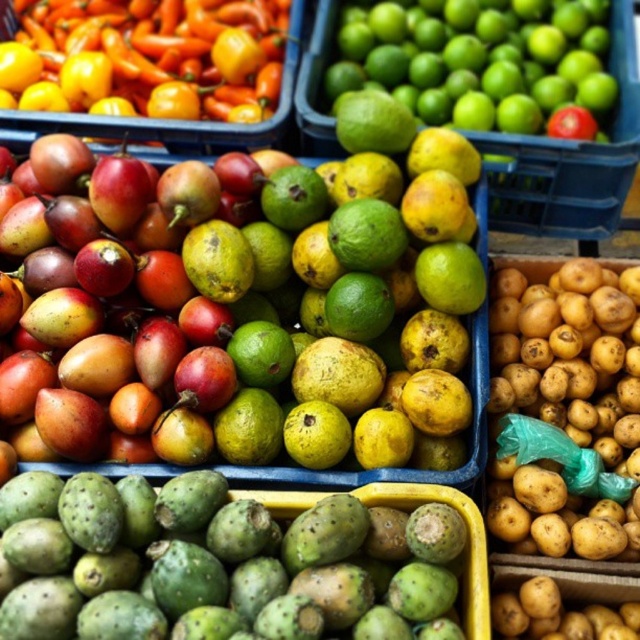
Question: Which of the following is the closest to the observer?

Choices:
 (A) green matte limes at upper right
 (B) green prickly at bottom left

Answer: (B)

Question: In this image, where is green prickly at bottom left located relative to smooth orange peppers at upper left?

Choices:
 (A) above
 (B) below

Answer: (B)

Question: Which object is farther from the camera taking this photo?

Choices:
 (A) green prickly at bottom left
 (B) red matte tomato at upper right
 (C) smooth orange peppers at upper left
 (D) green matte limes at upper right

Answer: (C)

Question: Is the position of green matte lime at upper right less distant than that of smooth orange peppers at upper left?

Choices:
 (A) yes
 (B) no

Answer: (A)

Question: Does green prickly at bottom left appear on the left side of smooth orange peppers at upper left?

Choices:
 (A) yes
 (B) no

Answer: (B)

Question: Considering the real-world distances, which object is closest to the green matte limes at upper right?

Choices:
 (A) red matte tomato at upper right
 (B) green matte lime at upper right
 (C) green prickly at bottom left

Answer: (A)